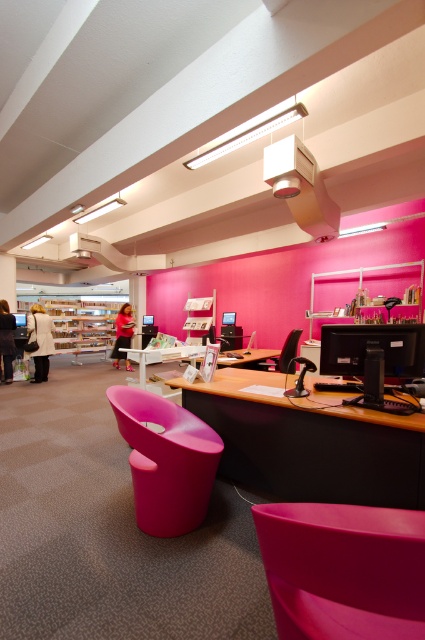
You are standing in the library and need to retrieve the white matte coat at center. There is a pink plastic table at center in the way. Can you walk directly to the coat without moving the table?

The pink plastic table at center is behind the white matte coat at center, so you can walk directly to the white matte coat at center without needing to move the table.

You are standing at the entrance of the library and see the matte black jacket at lower left. Where is the matte black jacket positioned relative to the entrance?

The matte black jacket at lower left is located at point (6,340), which is near the lower left corner of the entrance area.